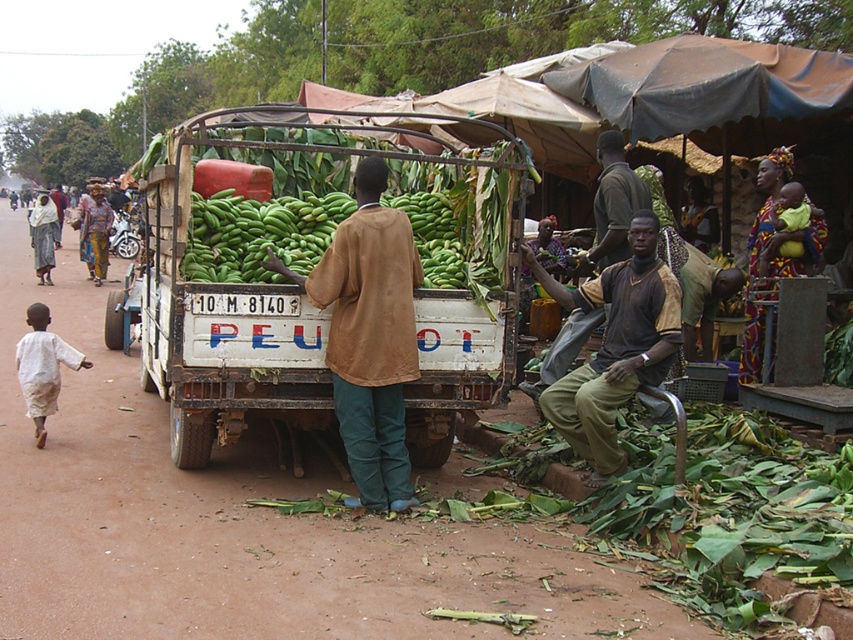
Question: Considering the relative positions of brown matte jacket at center and brown cotton shirt at center in the image provided, where is brown matte jacket at center located with respect to brown cotton shirt at center?

Choices:
 (A) above
 (B) below

Answer: (A)

Question: Can you confirm if green matte truck at center is positioned to the right of brown matte jacket at center?

Choices:
 (A) no
 (B) yes

Answer: (A)

Question: Estimate the real-world distances between objects in this image. Which object is closer to the green matte bananas at center?

Choices:
 (A) brown cotton shirt at center
 (B) brown matte jacket at center

Answer: (B)

Question: Does brown matte jacket at center appear over green matte bananas at center?

Choices:
 (A) yes
 (B) no

Answer: (B)

Question: Which object is closer to the camera taking this photo?

Choices:
 (A) green matte bananas at center
 (B) brown cotton shirt at center
 (C) brown matte jacket at center

Answer: (C)

Question: Which of the following is the closest to the observer?

Choices:
 (A) green matte bananas at center
 (B) brown cotton shirt at center
 (C) green matte truck at center

Answer: (A)